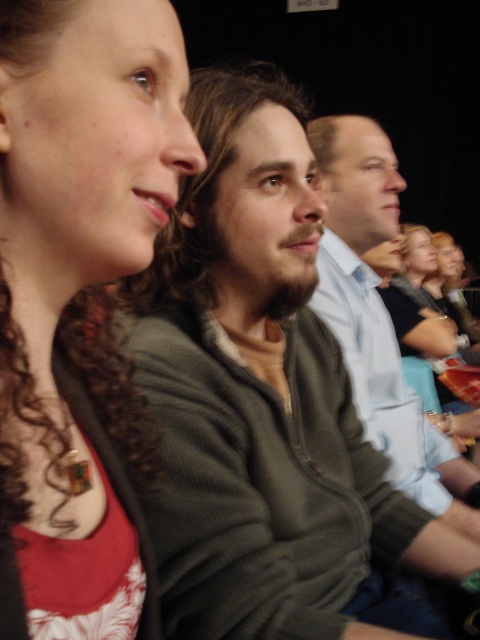
You are an usher in the theater and need to determine seating arrangements based on the image. Which of the two, the dark green sweater at center or the light blue shirt at center, is smaller in size?

The dark green sweater at center occupies less space than the light blue shirt at center, so the dark green sweater at center is smaller in size.

You are a photographer trying to capture a closeup of the dark green sweater at center and the matte green sweater at upper left. Which sweater should you focus on to ensure both are in focus if your camera can only focus on one subject at a time?

The dark green sweater at center is larger in size than the matte green sweater at upper left, so focusing on the larger sweater would likely keep both in focus as it is closer to the camera.

You are a photographer standing at the camera position. You want to take a photo of the dark green sweater at center. Can you focus on the sweater without adjusting your camera focus? The camera has a depth of field that can capture objects within 60 centimeters clearly.

The dark green sweater at center and the camera are 59.71 centimeters apart, which is within the 60 centimeter depth of field. Therefore, you can focus on the dark green sweater at center without adjusting the camera focus.